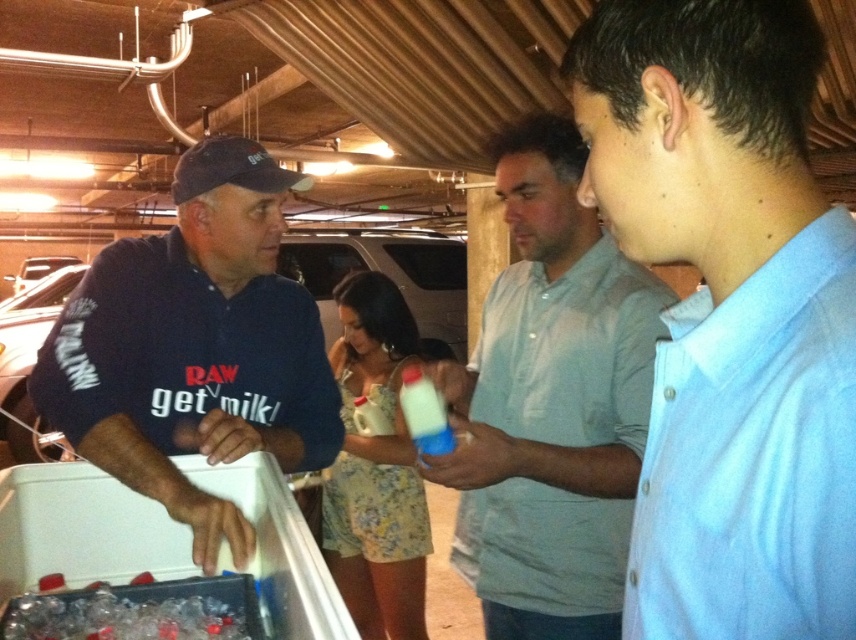
Is light gray button-up shirt at center above dark blue polo shirt at left?

Actually, light gray button-up shirt at center is below dark blue polo shirt at left.

Can you confirm if light gray button-up shirt at center is taller than dark blue polo shirt at left?

Correct, light gray button-up shirt at center is much taller as dark blue polo shirt at left.

I want to click on light gray button-up shirt at center, so click(x=550, y=403).

Find the location of a particular element. This screenshot has height=640, width=856. light gray button-up shirt at center is located at coordinates (550, 403).

Does light blue button-down shirt at center appear over translucent plastic bottle at center?

Yes, light blue button-down shirt at center is above translucent plastic bottle at center.

Is light blue button-down shirt at center positioned at the back of translucent plastic bottle at center?

No, it is in front of translucent plastic bottle at center.

This screenshot has height=640, width=856. Find the location of `light blue button-down shirt at center`. light blue button-down shirt at center is located at coordinates (729, 314).

Where is `light blue button-down shirt at center`? The width and height of the screenshot is (856, 640). light blue button-down shirt at center is located at coordinates (729, 314).

Looking at this image, who is higher up, light blue button-down shirt at center or light gray button-up shirt at center?

light blue button-down shirt at center is above.

Can you confirm if light blue button-down shirt at center is wider than light gray button-up shirt at center?

In fact, light blue button-down shirt at center might be narrower than light gray button-up shirt at center.

Find the location of `light blue button-down shirt at center`. light blue button-down shirt at center is located at coordinates (729, 314).

You are a GUI agent. You are given a task and a screenshot of the screen. Output one action in this format:
    pyautogui.click(x=<x>, y=<y>)
    Task: Click on the light blue button-down shirt at center
    This screenshot has height=640, width=856.
    Given the screenshot: What is the action you would take?
    pyautogui.click(x=729, y=314)